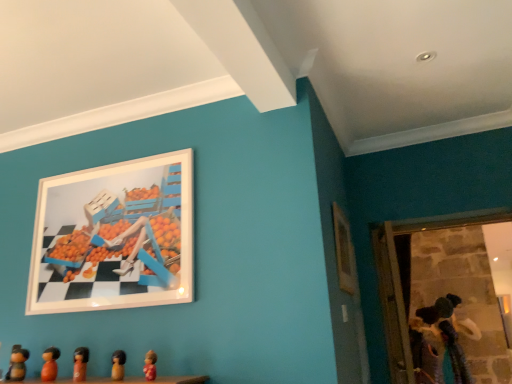
Question: Considering the positions of point (134, 173) and point (156, 377), is point (134, 173) closer or farther from the camera than point (156, 377)?

Choices:
 (A) farther
 (B) closer

Answer: (A)

Question: Visually, is white glossy picture frame at upper left, the second picture frame from the right, positioned to the left or to the right of wooden figurines at lower center?

Choices:
 (A) right
 (B) left

Answer: (A)

Question: Which object is the closest to the velvet plush doll at lower right, arranged as the 1th toy when viewed from the back?

Choices:
 (A) wooden figurine at lower center, the second toy from the top
 (B) wooden picture frame at upper right, which is the 2th picture frame from left to right
 (C) wooden figurine at lower left, the 5th toy positioned from the front
 (D) wooden figurine at lower left, marked as the second toy in a left-to-right arrangement
 (E) matte orange figurine at lower left, the third toy from the left

Answer: (B)

Question: Estimate the real-world distances between objects in this image. Which object is farther from the wooden figurines at lower center?

Choices:
 (A) matte orange figurine at lower left, the fourth toy from the back
 (B) wooden figurine at lower left, the fifth toy when ordered from top to bottom
 (C) white glossy picture frame at upper left, the first picture frame when ordered from left to right
 (D) wooden figurine at lower left, the fourth toy positioned from the top
 (E) wooden picture frame at upper right, which is the 2th picture frame from left to right

Answer: (E)